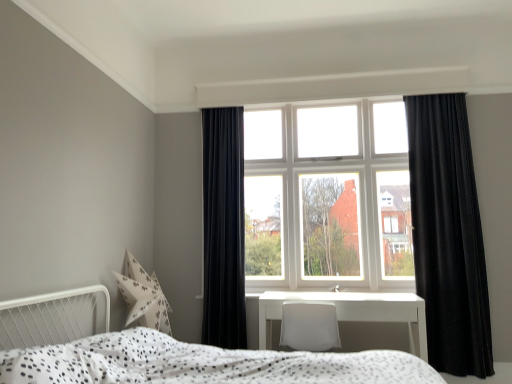
This screenshot has height=384, width=512. Identify the location of velvet black curtain at left, the second curtain in the right-to-left sequence. (223, 228).

The width and height of the screenshot is (512, 384). I want to click on black velvet curtain at right, the 2th curtain viewed from the left, so click(448, 235).

Identify the location of white dotted fabric bed at lower center. This screenshot has width=512, height=384. (166, 353).

What do you see at coordinates (327, 197) in the screenshot? I see `white glass window at center` at bounding box center [327, 197].

Where is `velvet black curtain at left, the second curtain in the right-to-left sequence`? The image size is (512, 384). velvet black curtain at left, the second curtain in the right-to-left sequence is located at coordinates (223, 228).

In the scene shown: Can you confirm if white glossy table at center is positioned to the left of black velvet curtain at right, the 2th curtain viewed from the left?

Yes, white glossy table at center is to the left of black velvet curtain at right, the 2th curtain viewed from the left.

Considering the relative sizes of white glossy table at center and black velvet curtain at right, the 2th curtain viewed from the left, in the image provided, is white glossy table at center smaller than black velvet curtain at right, the 2th curtain viewed from the left,?

Correct, white glossy table at center occupies less space than black velvet curtain at right, the 2th curtain viewed from the left.

From a real-world perspective, between white glossy table at center and black velvet curtain at right, the 2th curtain viewed from the left, who is vertically higher?

In real-world perspective, black velvet curtain at right, the 2th curtain viewed from the left, is above.

Could you tell me if white glossy table at center is turned towards black velvet curtain at right, the 2th curtain viewed from the left?

No.

Is black velvet curtain at right, placed as the 1th curtain when sorted from right to left, far from white glossy table at center?

No.

Locate an element on the screen. This screenshot has height=384, width=512. table that is below the black velvet curtain at right, the 2th curtain viewed from the left (from the image's perspective) is located at coordinates (352, 312).

Considering the relative sizes of black velvet curtain at right, placed as the 1th curtain when sorted from right to left, and white glossy table at center in the image provided, is black velvet curtain at right, placed as the 1th curtain when sorted from right to left, shorter than white glossy table at center?

Incorrect, the height of black velvet curtain at right, placed as the 1th curtain when sorted from right to left, does not fall short of that of white glossy table at center.

Can you confirm if white glossy table at center is shorter than white glass window at center?

Indeed, white glossy table at center has a lesser height compared to white glass window at center.

Does white glossy table at center lie in front of white glass window at center?

Yes, white glossy table at center is in front of white glass window at center.

The width and height of the screenshot is (512, 384). Find the location of `window above the white glossy table at center (from the image's perspective)`. window above the white glossy table at center (from the image's perspective) is located at coordinates (327, 197).

Is white glossy table at center not within white glass window at center?

Yes, white glossy table at center is outside of white glass window at center.

Considering the positions of points (59, 350) and (210, 266), is point (59, 350) closer to camera compared to point (210, 266)?

Yes, it is in front of point (210, 266).

Is white dotted fabric bed at lower center thinner than velvet black curtain at left, the second curtain in the right-to-left sequence?

In fact, white dotted fabric bed at lower center might be wider than velvet black curtain at left, the second curtain in the right-to-left sequence.

From the image's perspective, is white dotted fabric bed at lower center below velvet black curtain at left, the second curtain in the right-to-left sequence?

Yes, from the image's perspective, white dotted fabric bed at lower center is beneath velvet black curtain at left, the second curtain in the right-to-left sequence.

From the picture: Considering the relative sizes of white dotted fabric bed at lower center and velvet black curtain at left, the second curtain in the right-to-left sequence, in the image provided, is white dotted fabric bed at lower center smaller than velvet black curtain at left, the second curtain in the right-to-left sequence,?

No.

In the scene shown: Is black velvet curtain at right, the 2th curtain viewed from the left, facing towards white glass window at center?

No, black velvet curtain at right, the 2th curtain viewed from the left, is not oriented towards white glass window at center.

Does black velvet curtain at right, placed as the 1th curtain when sorted from right to left, have a greater height compared to white glass window at center?

Indeed, black velvet curtain at right, placed as the 1th curtain when sorted from right to left, has a greater height compared to white glass window at center.

From the picture: Can you confirm if black velvet curtain at right, the 2th curtain viewed from the left, is positioned to the left of white glass window at center?

Incorrect, black velvet curtain at right, the 2th curtain viewed from the left, is not on the left side of white glass window at center.

What's the angular difference between white dotted fabric bed at lower center and black velvet curtain at right, placed as the 1th curtain when sorted from right to left,'s facing directions?

90.4 degrees.

Can you confirm if white dotted fabric bed at lower center is wider than black velvet curtain at right, placed as the 1th curtain when sorted from right to left?

Correct, the width of white dotted fabric bed at lower center exceeds that of black velvet curtain at right, placed as the 1th curtain when sorted from right to left.

Find the location of a particular element. curtain on the right of white dotted fabric bed at lower center is located at coordinates (448, 235).

Does white dotted fabric bed at lower center have a lesser height compared to black velvet curtain at right, placed as the 1th curtain when sorted from right to left?

Yes, white dotted fabric bed at lower center is shorter than black velvet curtain at right, placed as the 1th curtain when sorted from right to left.

Looking at this image, is white glossy table at center surrounded by white glass window at center?

No, white glossy table at center is not inside white glass window at center.

Are white glass window at center and white glossy table at center located far from each other?

Absolutely, white glass window at center is distant from white glossy table at center.

This screenshot has width=512, height=384. What are the coordinates of `window above the white glossy table at center (from the image's perspective)` in the screenshot? It's located at (327, 197).

Is white glass window at center in front of white glossy table at center?

That is False.

Starting from the white glossy table at center, which curtain is the 1st one behind? Please provide its 2D coordinates.

[(448, 235)]

This screenshot has width=512, height=384. What are the coordinates of `table on the left of black velvet curtain at right, placed as the 1th curtain when sorted from right to left` in the screenshot? It's located at (352, 312).

In the scene shown: Considering their positions, is white glass window at center positioned closer to velvet black curtain at left, the second curtain in the right-to-left sequence, than white glossy table at center?

The object closer to velvet black curtain at left, the second curtain in the right-to-left sequence, is white glass window at center.

When comparing their distances from white glass window at center, does white dotted fabric bed at lower center or velvet black curtain at left, the second curtain in the right-to-left sequence, seem closer?

Based on the image, velvet black curtain at left, the second curtain in the right-to-left sequence, appears to be nearer to white glass window at center.

Which object lies nearer to the anchor point black velvet curtain at right, the 2th curtain viewed from the left, velvet black curtain at left, the first curtain positioned from the left, or white glass window at center?

Among the two, white glass window at center is located nearer to black velvet curtain at right, the 2th curtain viewed from the left.

When comparing their distances from white glass window at center, does white dotted fabric bed at lower center or white glossy table at center seem further?

white dotted fabric bed at lower center lies further to white glass window at center than the other object.

Considering their positions, is white glass window at center positioned closer to black velvet curtain at right, placed as the 1th curtain when sorted from right to left, than white glossy table at center?

The object closer to black velvet curtain at right, placed as the 1th curtain when sorted from right to left, is white glass window at center.

Estimate the real-world distances between objects in this image. Which object is further from white dotted fabric bed at lower center, velvet black curtain at left, the second curtain in the right-to-left sequence, or white glossy table at center?

Based on the image, velvet black curtain at left, the second curtain in the right-to-left sequence, appears to be further to white dotted fabric bed at lower center.

Estimate the real-world distances between objects in this image. Which object is closer to white dotted fabric bed at lower center, black velvet curtain at right, the 2th curtain viewed from the left, or white glass window at center?

white glass window at center lies closer to white dotted fabric bed at lower center than the other object.

Based on their spatial positions, is white glass window at center or black velvet curtain at right, placed as the 1th curtain when sorted from right to left, further from white dotted fabric bed at lower center?

black velvet curtain at right, placed as the 1th curtain when sorted from right to left.

This screenshot has height=384, width=512. Identify the location of table between white dotted fabric bed at lower center and black velvet curtain at right, placed as the 1th curtain when sorted from right to left, in the front-back direction. (352, 312).

This screenshot has width=512, height=384. I want to click on table located between white dotted fabric bed at lower center and velvet black curtain at left, the first curtain positioned from the left, in the depth direction, so [352, 312].

Find the location of a particular element. The width and height of the screenshot is (512, 384). table between white dotted fabric bed at lower center and white glass window at center in the front-back direction is located at coordinates (352, 312).

This screenshot has width=512, height=384. In order to click on curtain between white dotted fabric bed at lower center and velvet black curtain at left, the second curtain in the right-to-left sequence, along the z-axis in this screenshot , I will do `click(448, 235)`.